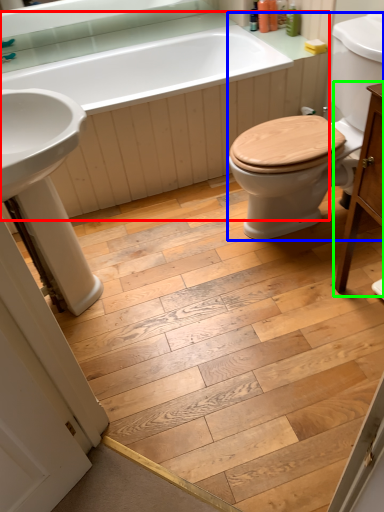
Question: Considering the real-world distances, which object is farthest from bath (highlighted by a red box)? sit (highlighted by a blue box) or vanity (highlighted by a green box)?

Choices:
 (A) sit
 (B) vanity

Answer: (B)